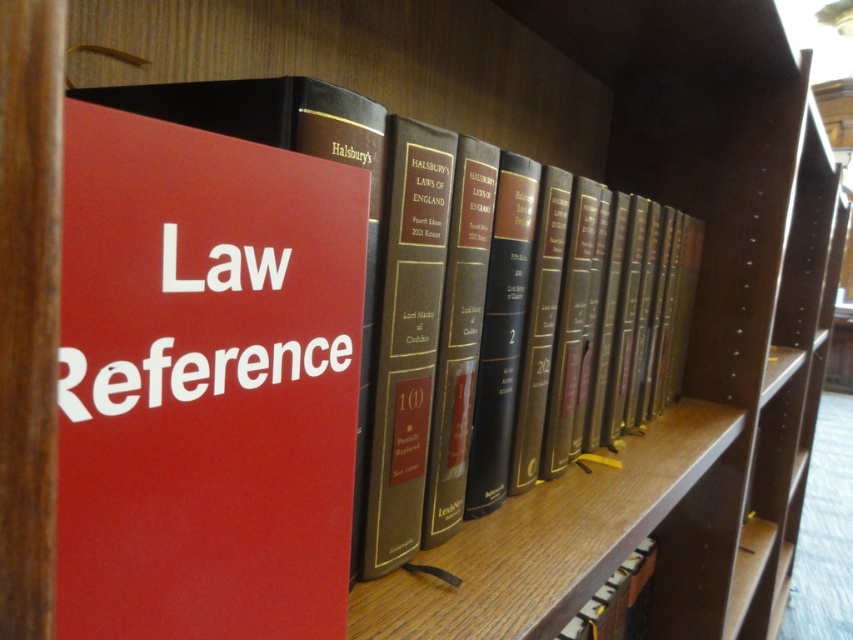
Question: Which of the following is the closest to the observer?

Choices:
 (A) red matte sign at center
 (B) hardcover book at center
 (C) matte red book at center

Answer: (C)

Question: Does red matte sign at center appear on the left side of hardcover book at center?

Choices:
 (A) yes
 (B) no

Answer: (A)

Question: Estimate the real-world distances between objects in this image. Which object is farther from the matte red book at center?

Choices:
 (A) hardcover book at center
 (B) red matte sign at center

Answer: (A)

Question: Which of the following is the farthest from the observer?

Choices:
 (A) red matte sign at center
 (B) matte red book at center
 (C) hardcover book at center

Answer: (C)

Question: Is the position of matte red book at center more distant than that of hardcover book at center?

Choices:
 (A) no
 (B) yes

Answer: (A)

Question: Is red matte sign at center thinner than hardcover book at center?

Choices:
 (A) no
 (B) yes

Answer: (B)